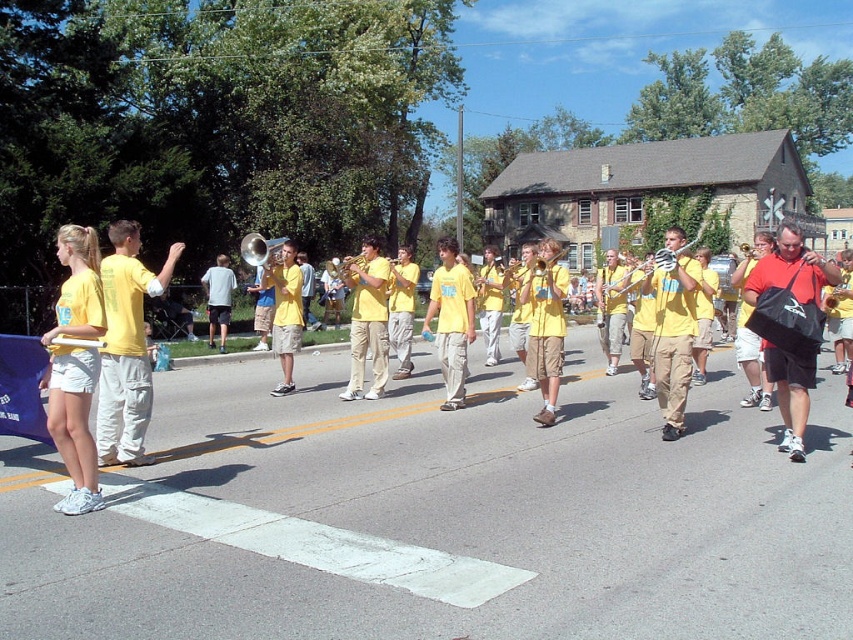
You are a photographer trying to capture the entire scene of the marching band and the building in the background. You notice two points in the image at coordinates point (x=62, y=456) and point (x=787, y=388). Which point is closer to your camera lens?

Point (x=62, y=456) is closer to the camera lens than point (x=787, y=388).

You are a photographer positioned on the sidewalk, aiming to capture a photo of the band members in the parade. You notice the yellow matte uniform at left and the khaki pants at center. Which object should you focus on first if you want to frame the subject closest to your left side?

You should focus on the yellow matte uniform at left first because it is positioned to the left of the khaki pants at center, making it closer to your left side.

You are a photographer trying to capture a clear shot of both the yellow matte uniform at left and the khaki pants at center. Based on their positions, which one is higher up in the frame?

The yellow matte uniform at left is above khaki pants at center, so it is higher up in the frame.